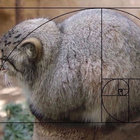
At what (x,y) coordinates should I click in order to perform the action: click on white fur. Please return your answer as a coordinate pair (x, y). This screenshot has width=140, height=140. Looking at the image, I should click on (92, 117).